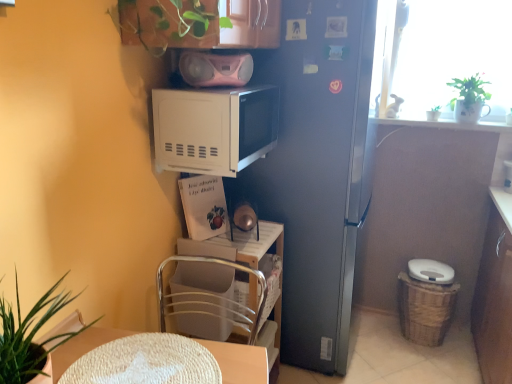
Locate an element on the screen. This screenshot has height=384, width=512. empty space that is ontop of white woven placemat at lower center is located at coordinates tap(147, 360).